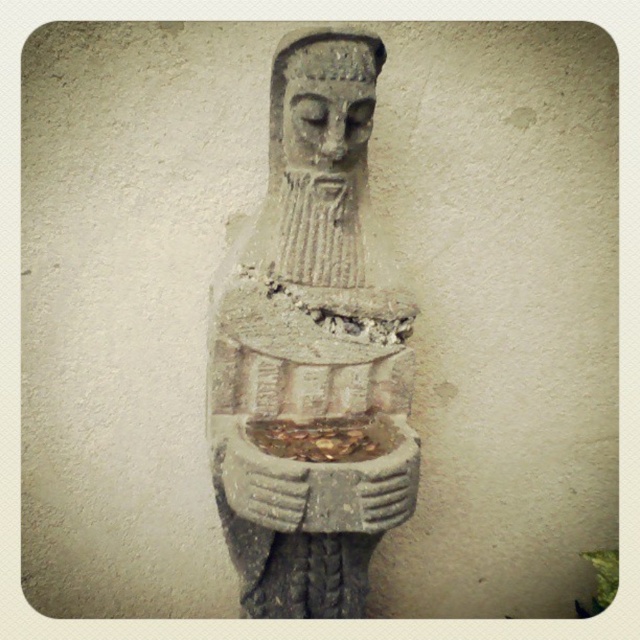
Question: Which object appears closest to the camera in this image?

Choices:
 (A) gray stone statue at center
 (B) gray stone head at center

Answer: (A)

Question: Does gray stone statue at center have a larger size compared to gray stone head at center?

Choices:
 (A) yes
 (B) no

Answer: (A)

Question: Which of the following is the farthest from the observer?

Choices:
 (A) [268, 129]
 (B) [337, 132]

Answer: (A)

Question: Is gray stone statue at center smaller than gray stone head at center?

Choices:
 (A) yes
 (B) no

Answer: (B)

Question: Which object appears farthest from the camera in this image?

Choices:
 (A) gray stone head at center
 (B) gray stone statue at center

Answer: (A)

Question: Is gray stone statue at center positioned behind gray stone head at center?

Choices:
 (A) yes
 (B) no

Answer: (B)